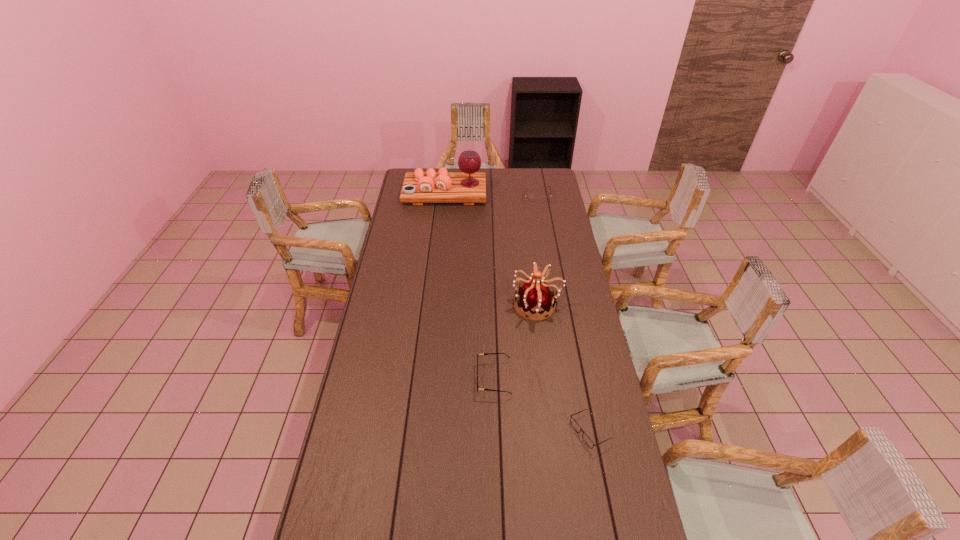
Image resolution: width=960 pixels, height=540 pixels. Identify the location of platter. (468, 186).

Identify the location of the third nearest object. Image resolution: width=960 pixels, height=540 pixels. (535, 296).

Where is `the farthest spectacles`? The width and height of the screenshot is (960, 540). the farthest spectacles is located at coordinates (530, 199).

You are a GUI agent. You are given a task and a screenshot of the screen. Output one action in this format:
    pyautogui.click(x=<x>, y=<y>)
    Task: Click on the leftmost spectacles
    The image size is (960, 540).
    Given the screenshot: What is the action you would take?
    pyautogui.click(x=483, y=353)

This screenshot has height=540, width=960. Identify the location of the second nearest object. (483, 353).

Find the location of `the nearest spectacles`. the nearest spectacles is located at coordinates (x=575, y=425).

Locate an element on the screen. This screenshot has height=540, width=960. free space located on the right of the platter is located at coordinates (494, 193).

Image resolution: width=960 pixels, height=540 pixels. Find the location of `vacant space located 0.320m on the front-facing side of the tiara`. vacant space located 0.320m on the front-facing side of the tiara is located at coordinates (436, 305).

This screenshot has height=540, width=960. I want to click on vacant area situated 0.340m on the front-facing side of the tiara, so coord(431,305).

Where is `vacant space situated 0.270m on the front-facing side of the tiara`? This screenshot has width=960, height=540. vacant space situated 0.270m on the front-facing side of the tiara is located at coordinates (447, 305).